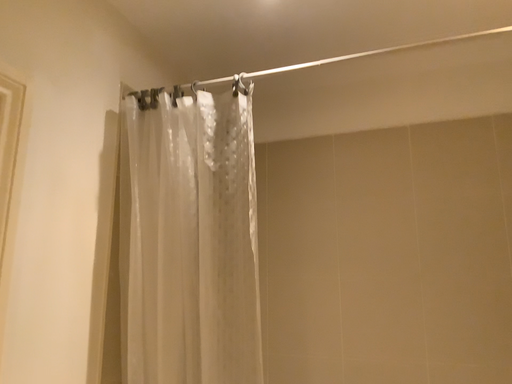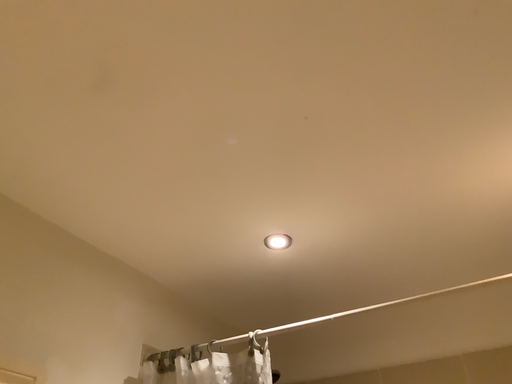
Question: Which way did the camera rotate in the video?

Choices:
 (A) rotated right
 (B) rotated left

Answer: (B)